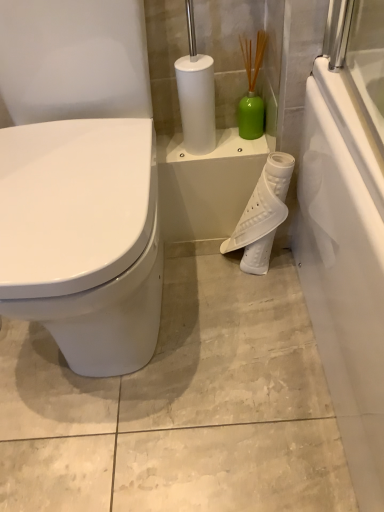
The height and width of the screenshot is (512, 384). I want to click on white plastic toilet paper at center, so click(262, 215).

What do you see at coordinates (262, 215) in the screenshot? The width and height of the screenshot is (384, 512). I see `white plastic toilet paper at center` at bounding box center [262, 215].

In order to click on white glossy toilet at left in this screenshot , I will do (85, 241).

Measure the distance between white glossy toilet at left and camera.

white glossy toilet at left is 62.14 centimeters from camera.

The image size is (384, 512). What do you see at coordinates (85, 241) in the screenshot?
I see `white glossy toilet at left` at bounding box center [85, 241].

Find the location of `white plastic toilet paper at center`. white plastic toilet paper at center is located at coordinates (262, 215).

Does white glossy toilet at left appear on the left side of white plastic toilet paper at center?

Indeed, white glossy toilet at left is positioned on the left side of white plastic toilet paper at center.

In the image, is white glossy toilet at left positioned in front of or behind white plastic toilet paper at center?

In the image, white glossy toilet at left appears in front of white plastic toilet paper at center.

Considering the points (141, 255) and (286, 161), which point is in front, point (141, 255) or point (286, 161)?

Point (141, 255)

From the image's perspective, is white glossy toilet at left positioned above or below white plastic toilet paper at center?

white glossy toilet at left is situated higher than white plastic toilet paper at center in the image.

From a real-world perspective, is white glossy toilet at left physically above white plastic toilet paper at center?

Yes, from a real-world perspective, white glossy toilet at left is on top of white plastic toilet paper at center.

Is white glossy toilet at left wider or thinner than white plastic toilet paper at center?

white glossy toilet at left is wider than white plastic toilet paper at center.

Between white glossy toilet at left and white plastic toilet paper at center, which one has more height?

white glossy toilet at left.

Who is smaller, white glossy toilet at left or white plastic toilet paper at center?

white plastic toilet paper at center is smaller.

Is white glossy toilet at left situated inside white plastic toilet paper at center or outside?

white glossy toilet at left is spatially situated outside white plastic toilet paper at center.

Are white glossy toilet at left and white plastic toilet paper at center beside each other?

No, white glossy toilet at left is not with white plastic toilet paper at center.

Is white glossy toilet at left oriented towards white plastic toilet paper at center?

No, white glossy toilet at left is not turned towards white plastic toilet paper at center.

At what (x,y) coordinates should I click in order to perform the action: click on toilet paper directly beneath the white glossy toilet at left (from a real-world perspective). Please return your answer as a coordinate pair (x, y). This screenshot has width=384, height=512. Looking at the image, I should click on (262, 215).

Is white plastic toilet paper at center at the right side of white glossy toilet at left?

Yes, white plastic toilet paper at center is to the right of white glossy toilet at left.

Is white plastic toilet paper at center in front of or behind white glossy toilet at left in the image?

white plastic toilet paper at center is positioned farther from the viewer than white glossy toilet at left.

Which is in front, point (259, 233) or point (46, 170)?

Positioned in front is point (46, 170).

From the image's perspective, is white plastic toilet paper at center located beneath white glossy toilet at left?

Correct, white plastic toilet paper at center appears lower than white glossy toilet at left in the image.

Based on the photo, from a real-world perspective, is white plastic toilet paper at center positioned above or below white glossy toilet at left?

From a real-world perspective, white plastic toilet paper at center is physically below white glossy toilet at left.

Considering the sizes of white plastic toilet paper at center and white glossy toilet at left in the image, is white plastic toilet paper at center wider or thinner than white glossy toilet at left?

Considering their sizes, white plastic toilet paper at center looks slimmer than white glossy toilet at left.

Which of these two, white plastic toilet paper at center or white glossy toilet at left, stands shorter?

white plastic toilet paper at center.

Does white plastic toilet paper at center have a smaller size compared to white glossy toilet at left?

Yes.

Is white plastic toilet paper at center located outside white glossy toilet at left?

Absolutely, white plastic toilet paper at center is external to white glossy toilet at left.

Based on the photo, is white plastic toilet paper at center in contact with white glossy toilet at left?

They are not placed beside each other.

Is white plastic toilet paper at center looking in the opposite direction of white glossy toilet at left?

That's not correct — white plastic toilet paper at center is not looking away from white glossy toilet at left.

Can you tell me how much white plastic toilet paper at center and white glossy toilet at left differ in facing direction?

There is a 0.686-degree angle between the facing directions of white plastic toilet paper at center and white glossy toilet at left.

Consider the image. How far apart are white plastic toilet paper at center and white glossy toilet at left?

white plastic toilet paper at center and white glossy toilet at left are 16.98 inches apart.

Where is `toilet paper behind the white glossy toilet at left`? toilet paper behind the white glossy toilet at left is located at coordinates (262, 215).

Identify the location of toilet located on the left of white plastic toilet paper at center. (85, 241).

Locate an element on the screen. toilet above the white plastic toilet paper at center (from the image's perspective) is located at coordinates (85, 241).